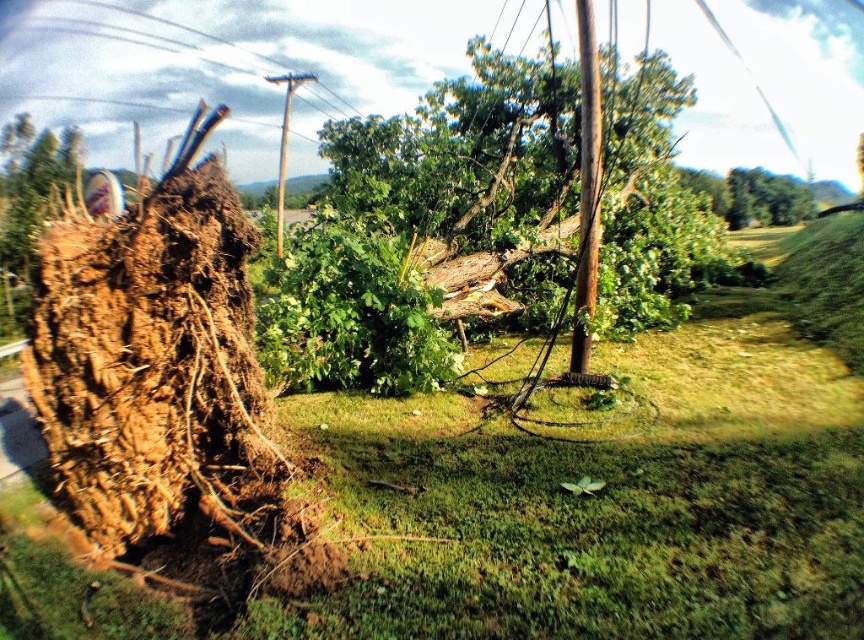
Looking at this image, based on the scene description, what are the coordinates of the green leafy tree at center?

The green leafy tree at center is located at coordinates (487, 221).

You are standing at the point labeled as point (287, 120) and want to move to the point labeled as point (757, 342). Is there a clear path between these two points without going around any obstacles?

The path between point (287, 120) and point (757, 342) is blocked by the large uprooted tree trunk lying horizontally on the ground in the foreground, so you cannot move directly between them without going around the obstacle.

You are a maintenance worker assessing the damage after a storm. You see the green grass at center and the brown wooden telegraph pole at upper center. Which object is positioned to the right of the other?

The green grass at center is positioned to the right of the brown wooden telegraph pole at upper center.